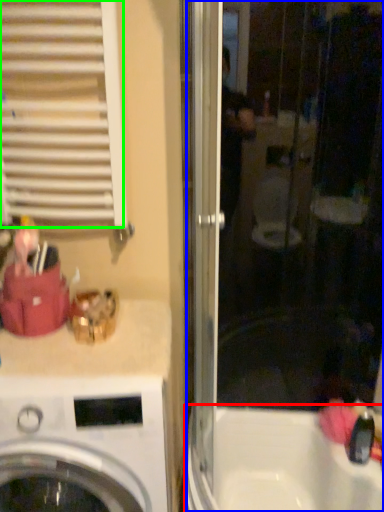
Question: Which is farther away from bath (highlighted by a red box)? screen door (highlighted by a blue box) or shutter (highlighted by a green box)?

Choices:
 (A) screen door
 (B) shutter

Answer: (B)